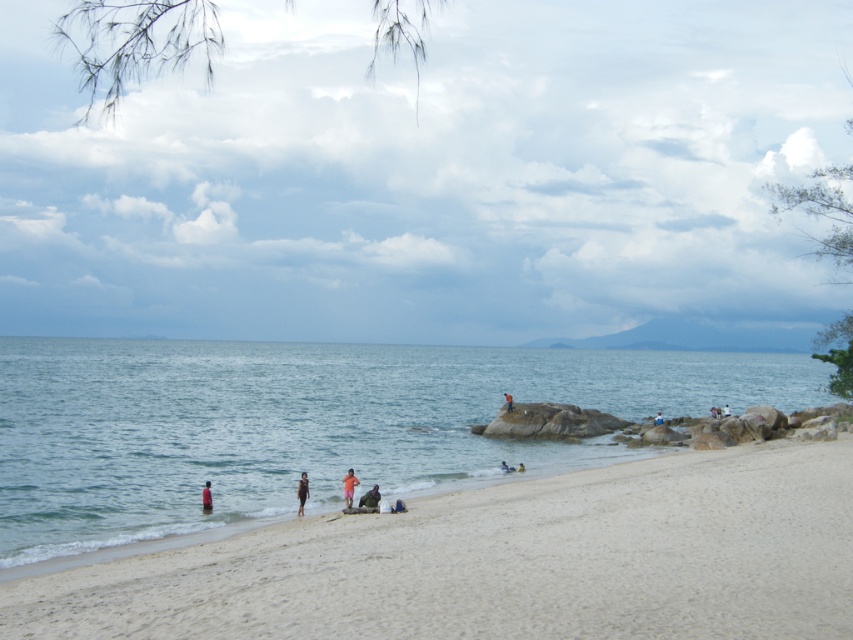
You are a child playing on the beach and you see the light brown wooden stick at center and the orange fabric person at center. Which object is taller?

The orange fabric person at center is taller than the light brown wooden stick at center.

You are standing on the beach and see the point at coordinates (715, 412). What object is this point located on?

The point at coordinates (715, 412) is located on the light brown wooden stick at center.